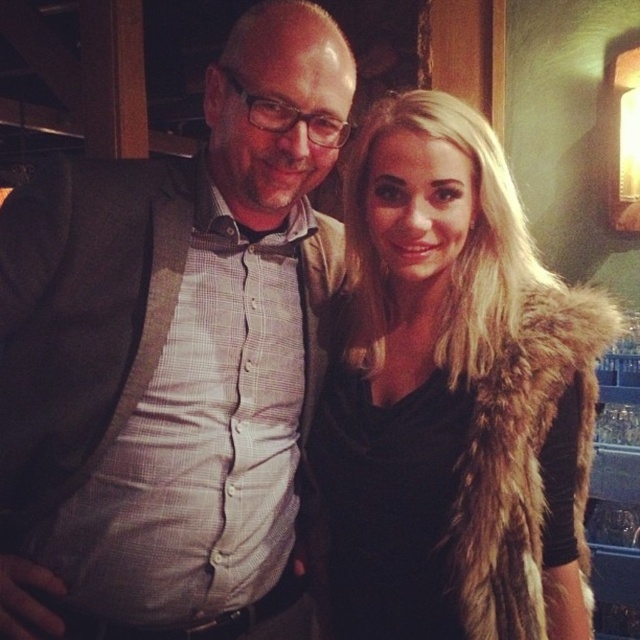
Does point (170, 220) come closer to viewer compared to point (545, 550)?

No, (170, 220) is behind (545, 550).

Does matte gray blazer at center appear under fur vest at center?

Actually, matte gray blazer at center is above fur vest at center.

Which is behind, point (198, 483) or point (548, 563)?

Point (198, 483)

At what (x,y) coordinates should I click in order to perform the action: click on matte gray blazer at center. Please return your answer as a coordinate pair (x, y). The width and height of the screenshot is (640, 640). Looking at the image, I should click on (173, 358).